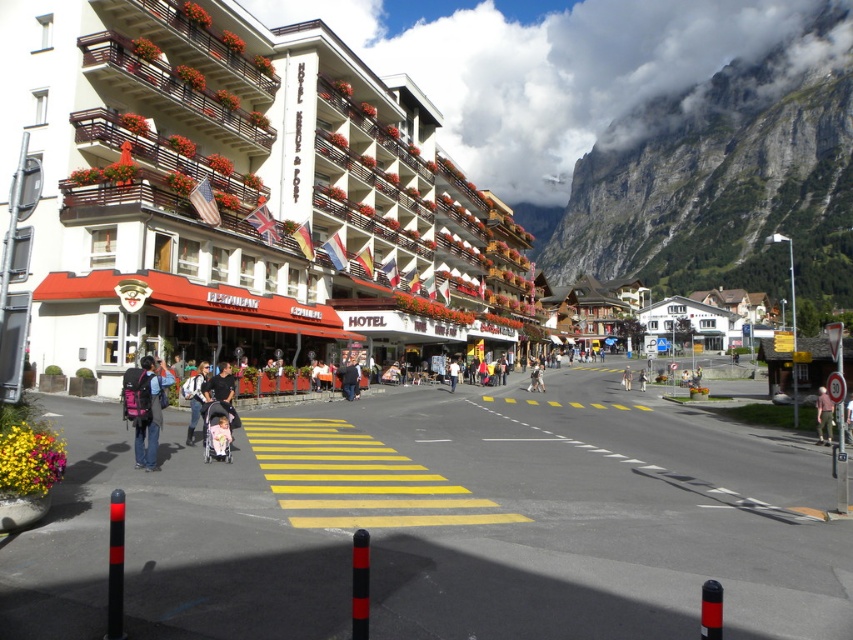
You are a tourist standing on the pedestrian crossing in the middle of the street. You notice a matte white building at center and a person wearing a dark blue jacket at center. Which object is taller?

The matte white building at center is taller than the dark blue jacket at center.

You are a delivery person with a 1.2 meter wide cart. You need to navigate through the street in the image. Can your cart fit between the matte white building at center and the matte black stroller at center?

The matte white building at center is wider than the matte black stroller at center. However, the description only states their relative widths, not the actual space between them. Without knowing the exact distance between the two objects, it is impossible to determine if the cart will fit.

You are a parent pushing a black fabric stroller at center along the street. There is a light brown leather jacket at center in your path. Can you pass through without moving the stroller sideways?

The black fabric stroller at center has a lesser width compared to light brown leather jacket at center, so yes, you can pass through without moving the stroller sideways since the stroller is narrower than the jacket.